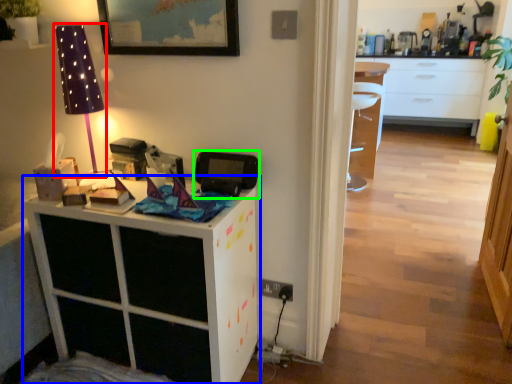
Question: Estimate the real-world distances between objects in this image. Which object is closer to table lamp (highlighted by a red box), cabinetry (highlighted by a blue box) or appliance (highlighted by a green box)?

Choices:
 (A) cabinetry
 (B) appliance

Answer: (B)